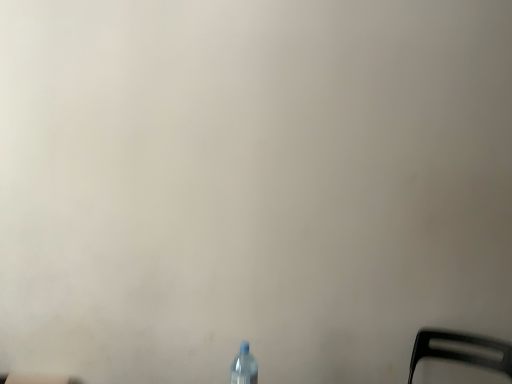
Question: Looking at their shapes, would you say black plastic chair at lower right is wider or thinner than transparent plastic bottle at lower center?

Choices:
 (A) thin
 (B) wide

Answer: (B)

Question: Would you say black plastic chair at lower right is to the left or to the right of transparent plastic bottle at lower center in the picture?

Choices:
 (A) right
 (B) left

Answer: (A)

Question: Based on their sizes in the image, would you say black plastic chair at lower right is bigger or smaller than transparent plastic bottle at lower center?

Choices:
 (A) big
 (B) small

Answer: (A)

Question: From their relative heights in the image, would you say transparent plastic bottle at lower center is taller or shorter than black plastic chair at lower right?

Choices:
 (A) tall
 (B) short

Answer: (A)

Question: In terms of width, does transparent plastic bottle at lower center look wider or thinner when compared to black plastic chair at lower right?

Choices:
 (A) wide
 (B) thin

Answer: (B)

Question: Is transparent plastic bottle at lower center in front of or behind black plastic chair at lower right in the image?

Choices:
 (A) behind
 (B) front

Answer: (B)

Question: From the image's perspective, is transparent plastic bottle at lower center positioned above or below black plastic chair at lower right?

Choices:
 (A) below
 (B) above

Answer: (B)